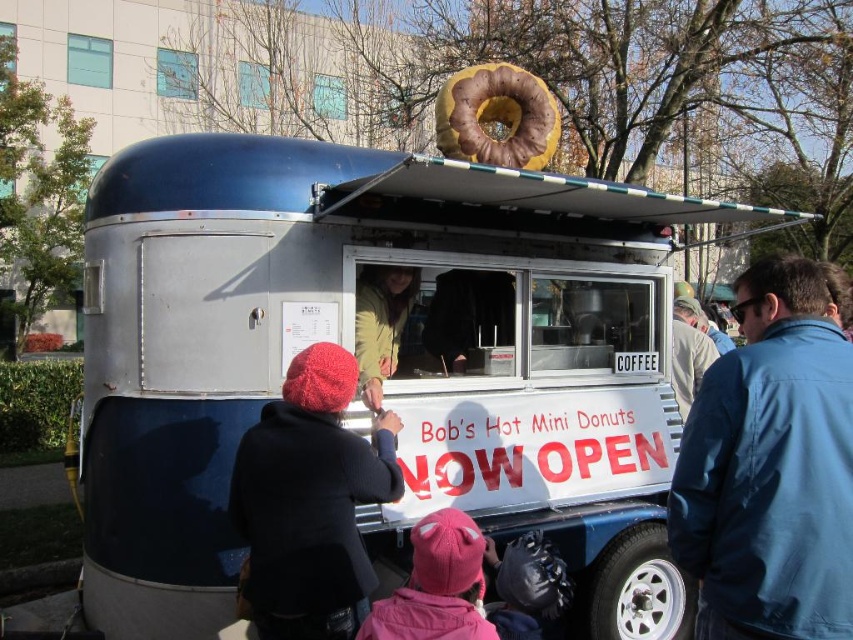
Does knitted wool hat at lower left appear on the left side of pink fleece hat at lower center?

Correct, you'll find knitted wool hat at lower left to the left of pink fleece hat at lower center.

Does point (349, 371) lie in front of point (409, 596)?

No, it is behind (409, 596).

Find the location of `knitted wool hat at lower left`. knitted wool hat at lower left is located at coordinates (310, 500).

Can you confirm if metallic silver food truck at center is smaller than blue fabric jacket at center right?

Incorrect, metallic silver food truck at center is not smaller in size than blue fabric jacket at center right.

Who is positioned more to the left, metallic silver food truck at center or blue fabric jacket at center right?

metallic silver food truck at center

I want to click on metallic silver food truck at center, so click(x=386, y=368).

Does knitted wool hat at lower left lie behind golden-brown glazed donut at center?

No.

Does knitted wool hat at lower left appear under golden-brown glazed donut at center?

Indeed, knitted wool hat at lower left is positioned under golden-brown glazed donut at center.

Which is in front, point (273, 616) or point (444, 125)?

Point (273, 616)

Locate an element on the screen. The image size is (853, 640). knitted wool hat at lower left is located at coordinates (310, 500).